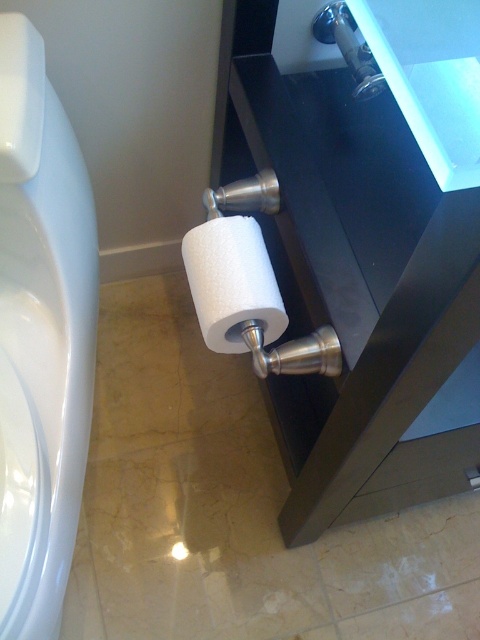
The width and height of the screenshot is (480, 640). What do you see at coordinates (40, 336) in the screenshot?
I see `white glossy toilet bowl at lower left` at bounding box center [40, 336].

Who is positioned more to the left, white glossy toilet bowl at lower left or white matte toilet paper at lower center?

Positioned to the left is white glossy toilet bowl at lower left.

Does point (95, 220) come closer to viewer compared to point (188, 243)?

No, (95, 220) is behind (188, 243).

Locate an element on the screen. The height and width of the screenshot is (640, 480). white glossy toilet bowl at lower left is located at coordinates (40, 336).